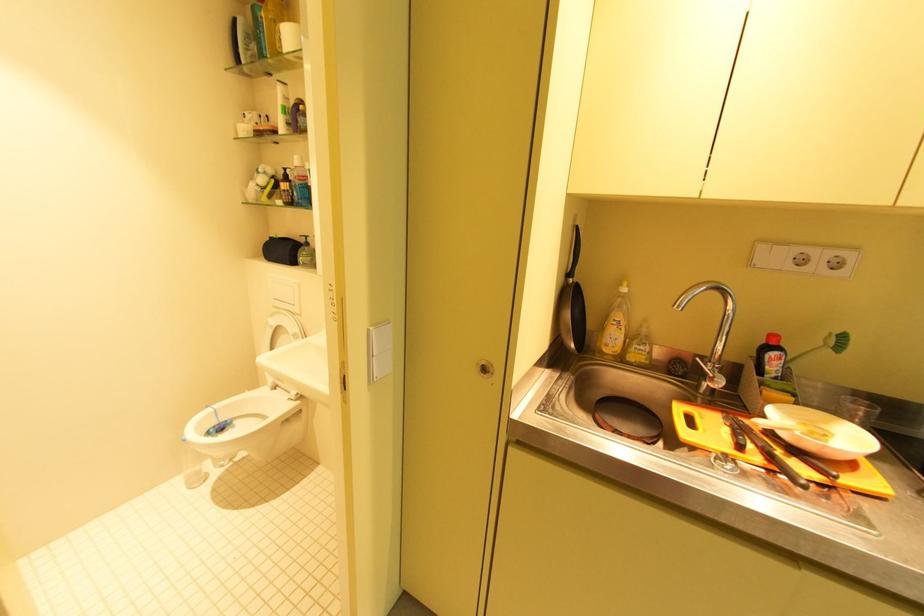
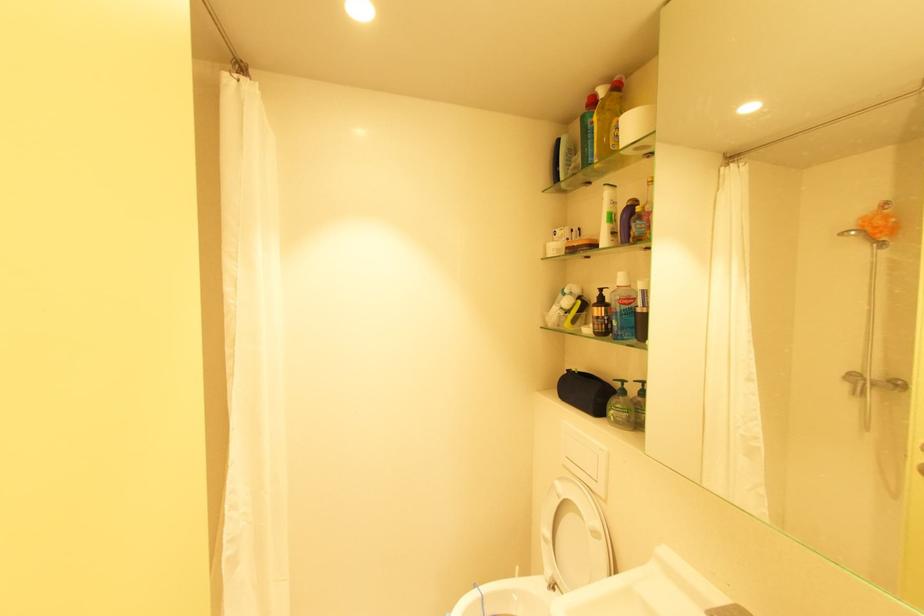
Question: Based on the continuous images, in which direction is the camera rotating? Reply with the corresponding letter.

Choices:
 (A) Left
 (B) Right
 (C) Up
 (D) Down

Answer: (A)